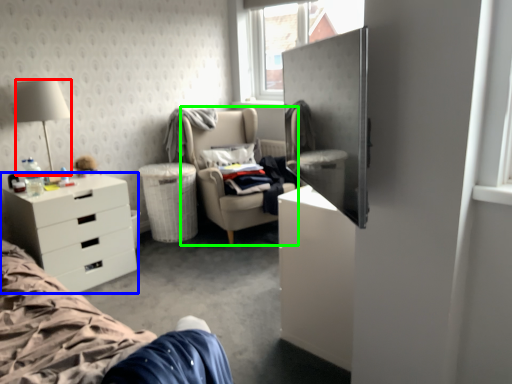
Question: Estimate the real-world distances between objects in this image. Which object is closer to lamp (highlighted by a red box), desk (highlighted by a blue box) or chair (highlighted by a green box)?

Choices:
 (A) desk
 (B) chair

Answer: (A)